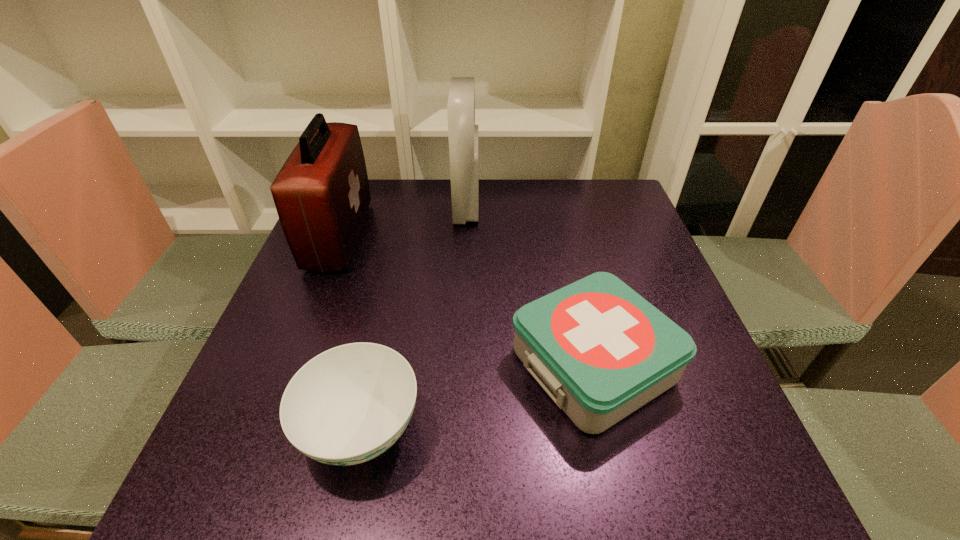
Image resolution: width=960 pixels, height=540 pixels. What are the coordinates of `vacant space at the near left corner` in the screenshot? It's located at (217, 476).

This screenshot has width=960, height=540. In order to click on vacant region between the second object from left to right and the shortest first-aid kit in this screenshot , I will do `click(477, 397)`.

The width and height of the screenshot is (960, 540). In order to click on blank region between the third object from left to right and the nearest first-aid kit in this screenshot , I will do `click(530, 286)`.

Identify the location of free spot between the leftmost first-aid kit and the second object from right to left. This screenshot has height=540, width=960. (403, 221).

Find the location of `unoccupied position between the second first-aid kit from left to right and the chinaware`. unoccupied position between the second first-aid kit from left to right and the chinaware is located at coordinates (414, 318).

At what (x,y) coordinates should I click in order to perform the action: click on unoccupied area between the shortest first-aid kit and the chinaware. Please return your answer as a coordinate pair (x, y). Image resolution: width=960 pixels, height=540 pixels. Looking at the image, I should click on (477, 397).

At what (x,y) coordinates should I click in order to perform the action: click on free space between the leftmost first-aid kit and the second first-aid kit from right to left. Please return your answer as a coordinate pair (x, y). The height and width of the screenshot is (540, 960). Looking at the image, I should click on (403, 221).

The image size is (960, 540). Find the location of `unoccupied area between the third object from right to left and the second first-aid kit from right to left`. unoccupied area between the third object from right to left and the second first-aid kit from right to left is located at coordinates (414, 318).

Locate an element on the screen. This screenshot has height=540, width=960. vacant area that lies between the leftmost object and the second first-aid kit from left to right is located at coordinates (403, 221).

Identify the location of unoccupied position between the chinaware and the second first-aid kit from left to right. Image resolution: width=960 pixels, height=540 pixels. (414, 318).